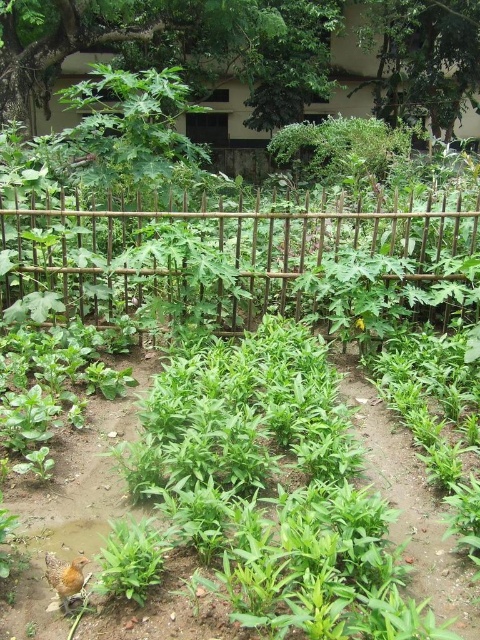
Question: Which of the following is the farthest from the observer?

Choices:
 (A) (377, 237)
 (B) (365, 461)

Answer: (A)

Question: Which object is farther from the camera taking this photo?

Choices:
 (A) brown metal fence at center
 (B) green leafy plants at center

Answer: (A)

Question: Considering the relative positions of brown metal fence at center and green leafy plants at center in the image provided, where is brown metal fence at center located with respect to green leafy plants at center?

Choices:
 (A) above
 (B) below

Answer: (A)

Question: Which object appears farthest from the camera in this image?

Choices:
 (A) brown metal fence at center
 (B) green leafy plants at center

Answer: (A)

Question: Is brown metal fence at center wider than green leafy plants at center?

Choices:
 (A) no
 (B) yes

Answer: (B)

Question: Is brown metal fence at center smaller than green leafy plants at center?

Choices:
 (A) yes
 (B) no

Answer: (B)